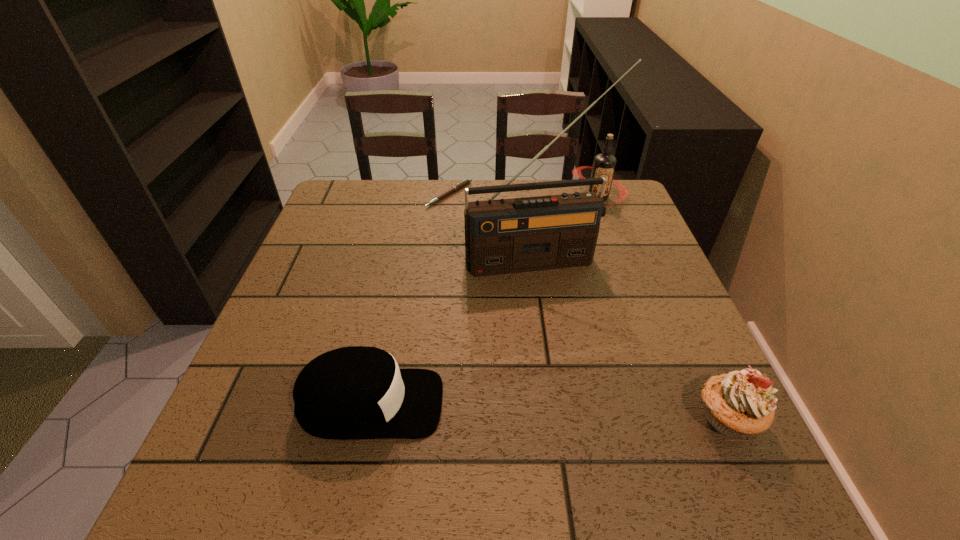
Image resolution: width=960 pixels, height=540 pixels. I want to click on cupcake that is positioned at the near edge, so click(740, 403).

This screenshot has width=960, height=540. What are the coordinates of `object present at the left edge` in the screenshot? It's located at (357, 392).

Where is `cupcake that is at the right edge`? cupcake that is at the right edge is located at coordinates (740, 403).

This screenshot has height=540, width=960. What are the coordinates of `radio receiver situated at the right edge` in the screenshot? It's located at (505, 236).

Image resolution: width=960 pixels, height=540 pixels. Identify the location of root beer located in the right edge section of the desktop. (604, 164).

The width and height of the screenshot is (960, 540). I want to click on object at the near left corner, so click(357, 392).

Where is `object located at the far right corner`? object located at the far right corner is located at coordinates (604, 164).

You are a GUI agent. You are given a task and a screenshot of the screen. Output one action in this format:
    pyautogui.click(x=<x>, y=<y>)
    Task: Click on the object present at the near right corner
    
    Given the screenshot: What is the action you would take?
    pyautogui.click(x=740, y=403)

The height and width of the screenshot is (540, 960). Identify the location of vacant space at the far edge of the desktop. (461, 209).

Identify the location of free space at the near edge of the desktop. (609, 411).